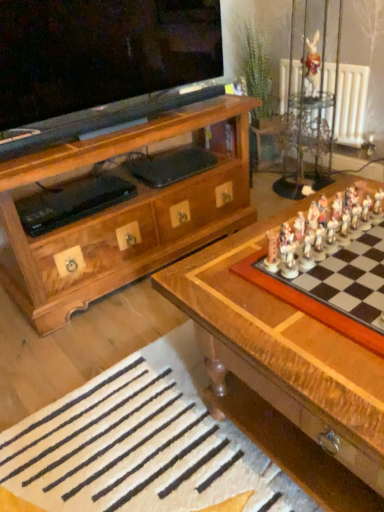
The image size is (384, 512). Describe the element at coordinates (306, 142) in the screenshot. I see `clear glass vase at upper right` at that location.

You are a GUI agent. You are given a task and a screenshot of the screen. Output one action in this format:
    pyautogui.click(x=<x>, y=<y>)
    Task: Click on the white wool rug at lower center
    
    Given the screenshot: What is the action you would take?
    (139, 450)

Looking at this image, what is the approximate height of wooden chessboard at right?

0.88 inches.

The image size is (384, 512). I want to click on wooden chessboard at right, so click(x=331, y=268).

You are a GUI agent. You are given a task and a screenshot of the screen. Output one action in this format:
    pyautogui.click(x=<x>, y=<y>)
    Task: Click on the wooden rabbit at upper right
    The height and width of the screenshot is (512, 384).
    Given the screenshot: What is the action you would take?
    pyautogui.click(x=311, y=65)

Is white wool rug at lower center positioned behind white painted radiator at upper right?

No, it is in front of white painted radiator at upper right.

Is white wool rug at lower center surrounding white painted radiator at upper right?

No.

Does white wool rug at lower center have a greater height compared to white painted radiator at upper right?

No, white wool rug at lower center is not taller than white painted radiator at upper right.

Is point (201, 406) positioned after point (340, 101)?

No.

From a real-world perspective, who is located higher, white painted radiator at upper right or wooden rabbit at upper right?

From a 3D spatial view, wooden rabbit at upper right is above.

From the image's perspective, which object appears higher, white painted radiator at upper right or wooden rabbit at upper right?

wooden rabbit at upper right is shown above in the image.

Considering the sizes of objects white painted radiator at upper right and wooden rabbit at upper right in the image provided, who is bigger, white painted radiator at upper right or wooden rabbit at upper right?

white painted radiator at upper right is bigger.

From a real-world perspective, who is located lower, wooden rabbit at upper right or white painted radiator at upper right?

white painted radiator at upper right, from a real-world perspective.

Considering the relative sizes of wooden rabbit at upper right and white painted radiator at upper right in the image provided, is wooden rabbit at upper right shorter than white painted radiator at upper right?

Indeed, wooden rabbit at upper right has a lesser height compared to white painted radiator at upper right.

Could you tell me if wooden rabbit at upper right is turned towards white painted radiator at upper right?

No, wooden rabbit at upper right does not turn towards white painted radiator at upper right.

Considering the sizes of objects wooden rabbit at upper right and white painted radiator at upper right in the image provided, who is bigger, wooden rabbit at upper right or white painted radiator at upper right?

white painted radiator at upper right.

Would you say clear glass vase at upper right is part of wooden chessboard at center's contents?

Definitely not — clear glass vase at upper right is not inside wooden chessboard at center.

In terms of size, does wooden chessboard at center appear bigger or smaller than clear glass vase at upper right?

In the image, wooden chessboard at center appears to be larger than clear glass vase at upper right.

Looking at this image, what's the angular difference between wooden chessboard at center and clear glass vase at upper right's facing directions?

20.1 degrees separate the facing orientations of wooden chessboard at center and clear glass vase at upper right.

Which object is wider, wooden chessboard at center or clear glass vase at upper right?

With larger width is wooden chessboard at center.

Is white painted radiator at upper right smaller than wooden chessboard at center?

Indeed, white painted radiator at upper right has a smaller size compared to wooden chessboard at center.

Measure the distance from white painted radiator at upper right to wooden chessboard at center.

white painted radiator at upper right and wooden chessboard at center are 5.48 feet apart.

The height and width of the screenshot is (512, 384). What are the coordinates of `radiator lying behind the wooden chessboard at center` in the screenshot? It's located at point(351,104).

Between white painted radiator at upper right and wooden chessboard at center, which one has smaller width?

white painted radiator at upper right.

From a real-world perspective, is wooden chessboard at center under white painted radiator at upper right?

Yes, from a real-world perspective, wooden chessboard at center is below white painted radiator at upper right.

From the image's perspective, between wooden chessboard at center and white painted radiator at upper right, who is located below?

wooden chessboard at center.

Is wooden chessboard at center looking in the opposite direction of white painted radiator at upper right?

No, wooden chessboard at center's orientation is not away from white painted radiator at upper right.

Does wooden chessboard at center touch white painted radiator at upper right?

wooden chessboard at center and white painted radiator at upper right are not in contact.

From the picture: Is wooden rabbit at upper right positioned beyond the bounds of wooden chessboard at center?

Yes, wooden rabbit at upper right is located beyond the bounds of wooden chessboard at center.

How distant is wooden rabbit at upper right from wooden chessboard at center?

A distance of 1.90 meters exists between wooden rabbit at upper right and wooden chessboard at center.

Can you confirm if wooden rabbit at upper right is bigger than wooden chessboard at center?

No.

Can you confirm if wooden rabbit at upper right is positioned to the right of wooden chessboard at center?

Yes.

I want to click on board in front of the white painted radiator at upper right, so click(139, 450).

This screenshot has width=384, height=512. Identify the location of toy above the white painted radiator at upper right (from the image's perspective). (311, 65).

Considering their positions, is wooden chessboard at right positioned closer to wooden chessboard at center than clear glass vase at upper right?

Based on the image, wooden chessboard at right appears to be nearer to wooden chessboard at center.

Considering their positions, is clear glass vase at upper right positioned closer to wooden chessboard at center than wooden rabbit at upper right?

clear glass vase at upper right.

Based on their spatial positions, is white wool rug at lower center or wooden chessboard at center closer to wooden chessboard at right?

wooden chessboard at center is closer to wooden chessboard at right.

Considering their positions, is wooden chessboard at center positioned closer to wooden rabbit at upper right than wooden chessboard at right?

wooden chessboard at right.

Considering their positions, is wooden chessboard at center positioned further to clear glass vase at upper right than white painted radiator at upper right?

wooden chessboard at center is further to clear glass vase at upper right.

From the image, which object appears to be nearer to wooden chessboard at center, white wool rug at lower center or white painted radiator at upper right?

white wool rug at lower center.

Looking at the image, which one is located further to white wool rug at lower center, wooden rabbit at upper right or clear glass vase at upper right?

Among the two, wooden rabbit at upper right is located further to white wool rug at lower center.

Considering their positions, is white painted radiator at upper right positioned further to white wool rug at lower center than wooden chessboard at center?

white painted radiator at upper right.

Identify the location of toy between white wool rug at lower center and clear glass vase at upper right in the front-back direction. (311, 65).

At what (x,y) coordinates should I click in order to perform the action: click on board positioned between wooden chessboard at right and wooden rabbit at upper right from near to far. Please return your answer as a coordinate pair (x, y). Looking at the image, I should click on (139, 450).

You are a GUI agent. You are given a task and a screenshot of the screen. Output one action in this format:
    pyautogui.click(x=<x>, y=<y>)
    Task: Click on the radiator that lies between wooden rabbit at upper right and clear glass vase at upper right from top to bottom
    The image size is (384, 512).
    Given the screenshot: What is the action you would take?
    pyautogui.click(x=351, y=104)

Locate an element on the screen. This screenshot has height=512, width=384. board game located between wooden chessboard at center and white painted radiator at upper right in the depth direction is located at coordinates (331, 268).